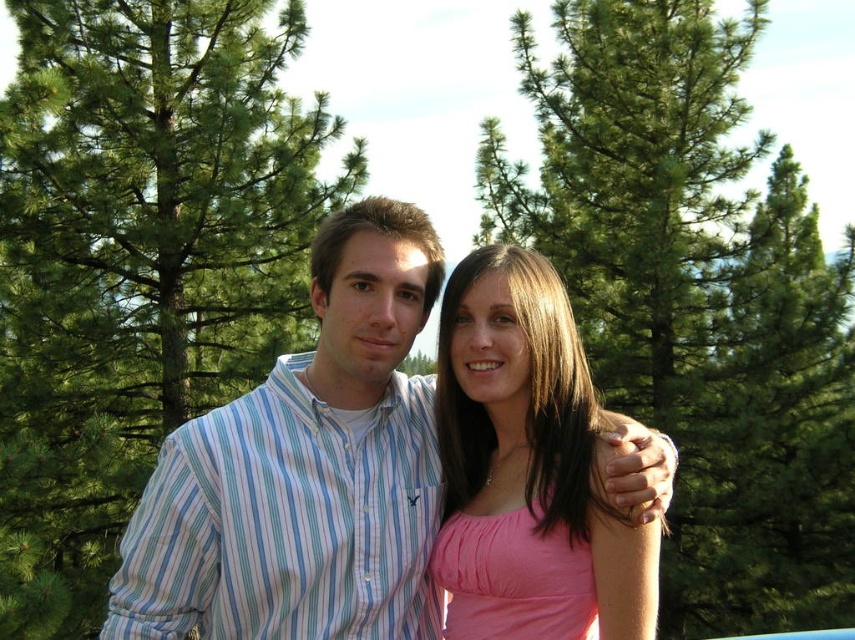
This screenshot has width=855, height=640. What do you see at coordinates (139, 260) in the screenshot? I see `green leafy tree at center` at bounding box center [139, 260].

Between green leafy tree at center and pink satin dress at center, which one has more height?

pink satin dress at center

Is point (40, 592) less distant than point (640, 564)?

No, (40, 592) is further to viewer.

This screenshot has height=640, width=855. What are the coordinates of `green leafy tree at center` in the screenshot? It's located at (139, 260).

Is green needle-like tree at center smaller than striped cotton shirt at center?

Indeed, green needle-like tree at center has a smaller size compared to striped cotton shirt at center.

Is green needle-like tree at center bigger than striped cotton shirt at center?

No, green needle-like tree at center is not bigger than striped cotton shirt at center.

Who is more forward, (805, 436) or (268, 556)?

Point (268, 556) is more forward.

This screenshot has width=855, height=640. I want to click on green needle-like tree at center, so pyautogui.click(x=694, y=300).

Describe the element at coordinates (139, 260) in the screenshot. I see `green leafy tree at center` at that location.

Is point (74, 492) positioned behind point (848, 396)?

No, (74, 492) is closer to viewer.

Who is more forward, (x=80, y=337) or (x=685, y=586)?

Point (x=80, y=337)

Locate an element on the screen. The height and width of the screenshot is (640, 855). green leafy tree at center is located at coordinates (139, 260).